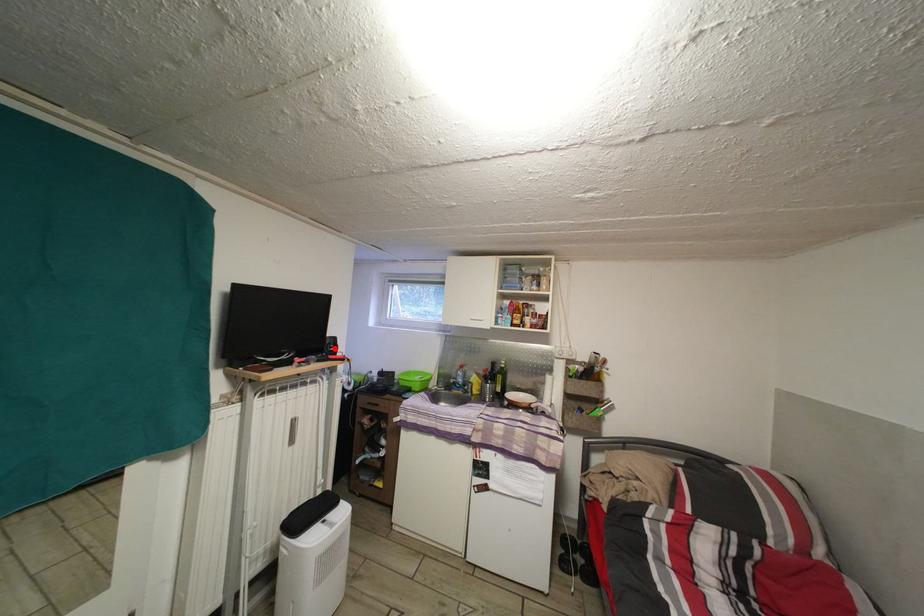
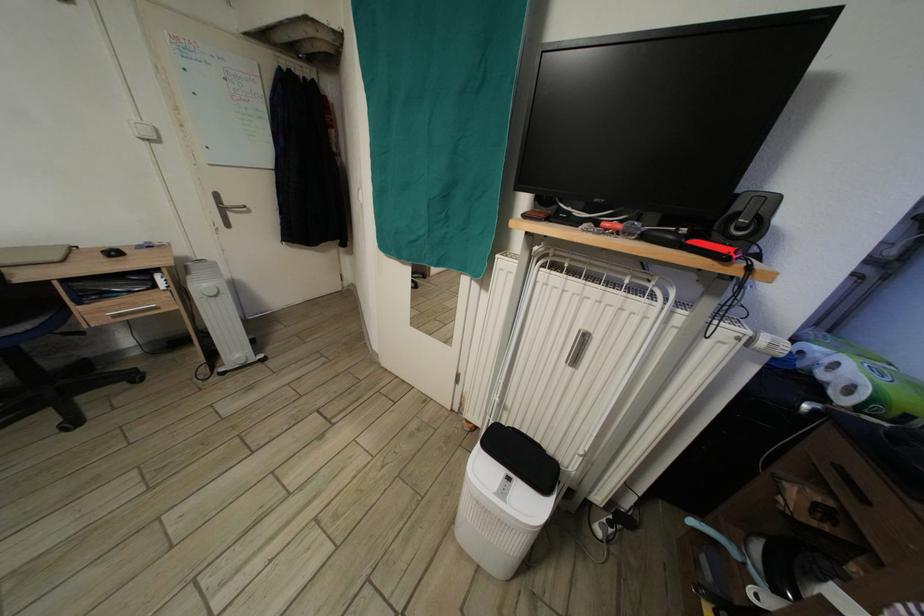
Find the pixel in the second image that matches the highlighted location in the first image.

(744, 214)